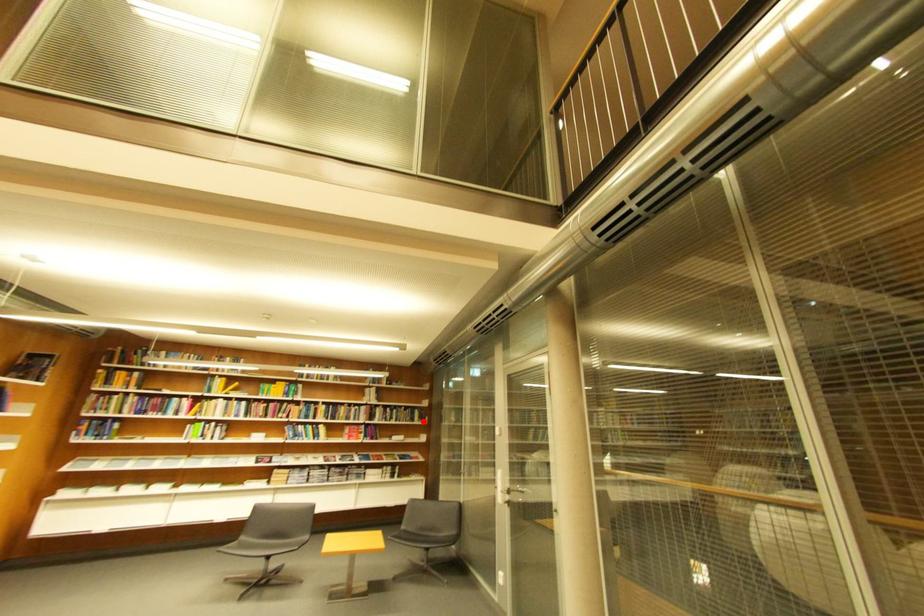
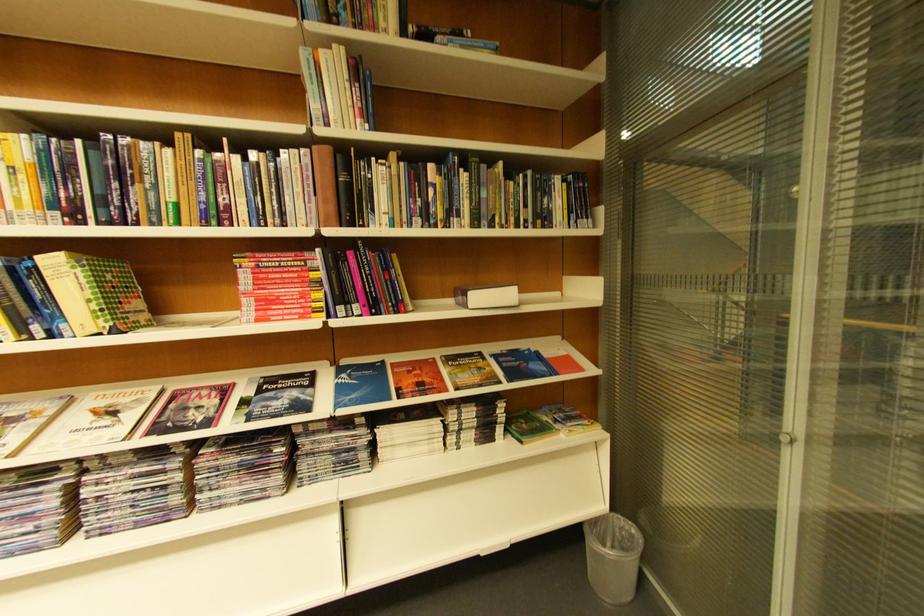
The point at the highlighted location is marked in the first image. Where is the corresponding point in the second image?

(554, 221)